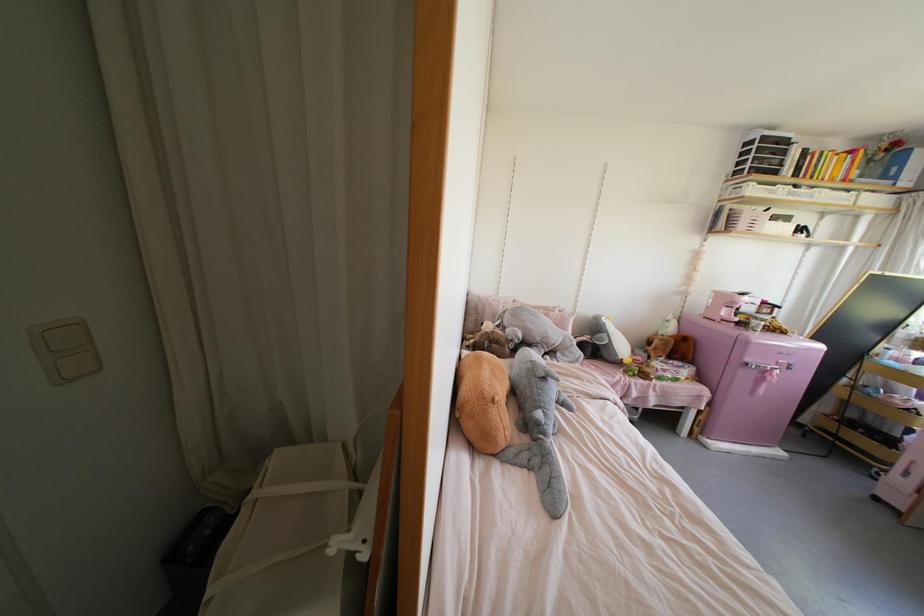
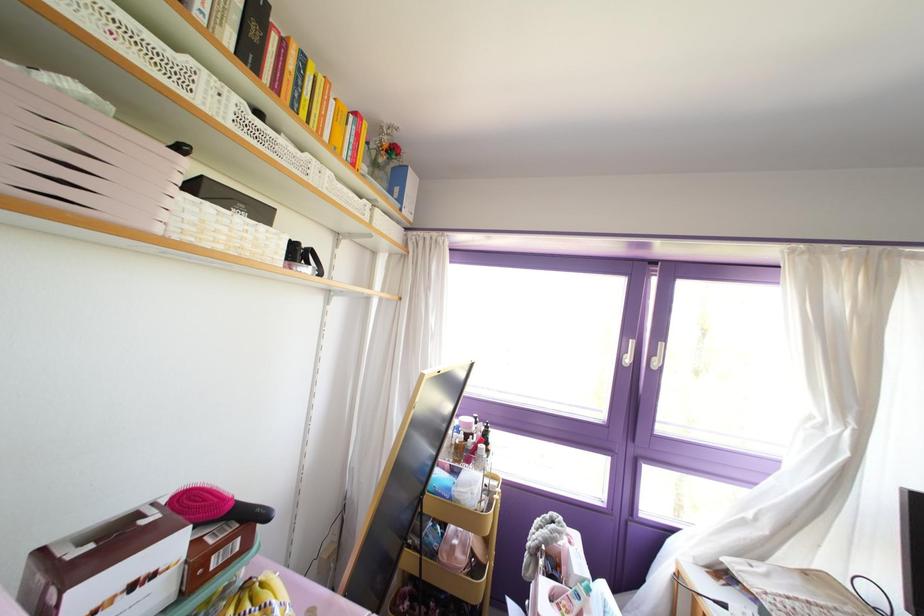
Locate, in the second image, the point that corresponds to pixel 869 160 in the first image.

(372, 163)